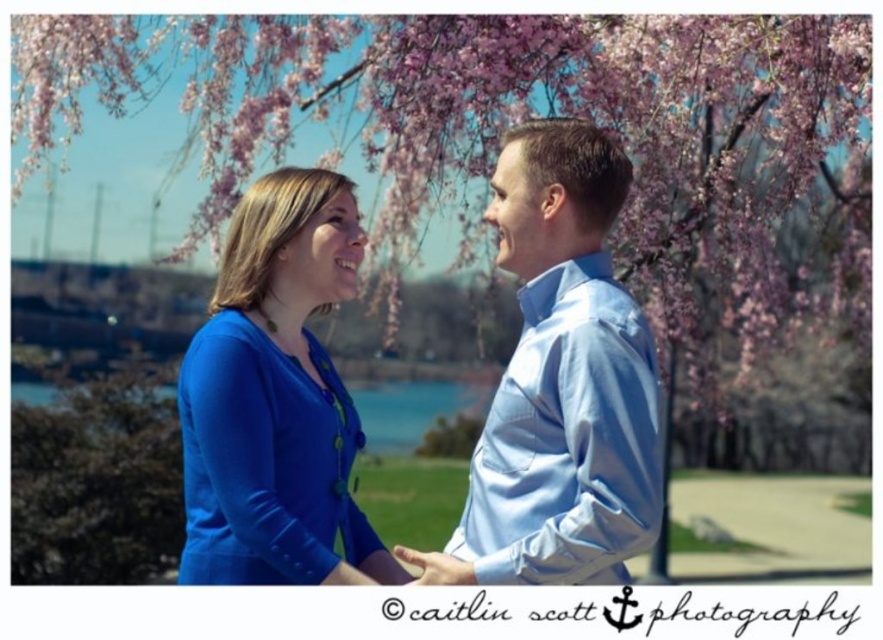
You are standing in the park scene with two people under cherry blossoms. You need to place a small decoration between the two points labeled as point (655, 284) and point (57, 420). Which point should the decoration be closer to if it needs to be nearer to the viewer?

The decoration should be placed closer to point (655, 284) because it is closer to the viewer than point (57, 420).

You are an artist planning to sketch this scene. You want to ensure the pink silky flower at upper center and the matte blue blouse at center are proportionally accurate. Which object should you draw first to maintain proper scale?

The pink silky flower at upper center should be drawn first because it is larger than the matte blue blouse at center, ensuring the scale relationship between them is correctly established.

From the picture: You are an artist trying to sketch this scene. You want to ensure the pink silky flower at upper center and the matte blue shirt at center are proportionally accurate. Which object should you draw larger?

The pink silky flower at upper center should be drawn larger than the matte blue shirt at center because it is bigger than the matte blue shirt at center according to the description.